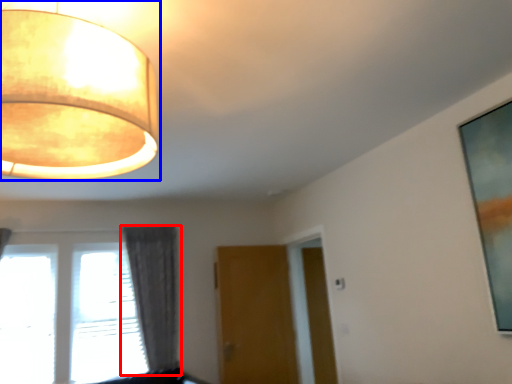
Question: Which object appears closest to the camera in this image, curtain (highlighted by a red box) or lamp (highlighted by a blue box)?

Choices:
 (A) curtain
 (B) lamp

Answer: (B)